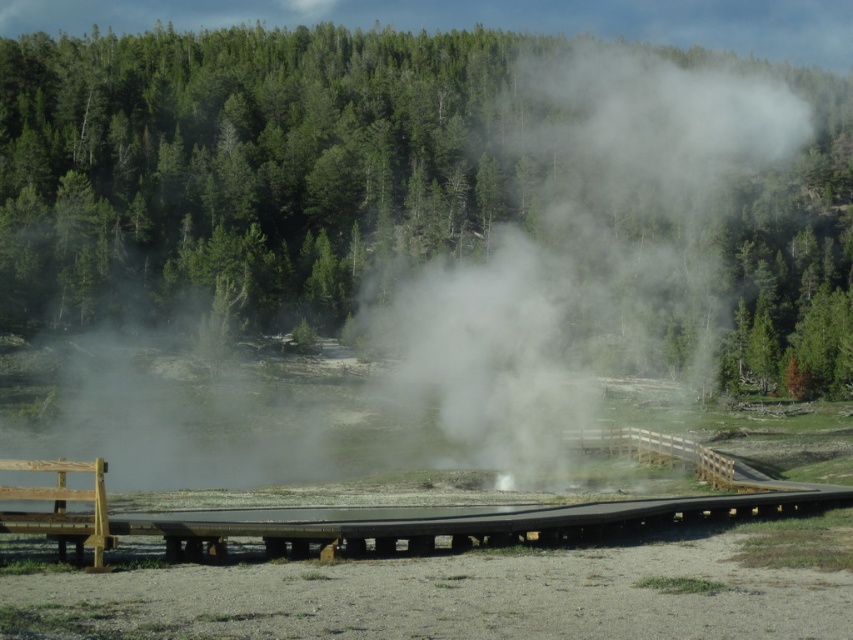
Where is `black wood rail at center`? black wood rail at center is located at coordinates (479, 516).

Which is below, black wood rail at center or wooden park bench at lower left?

black wood rail at center is below.

Is point (547, 516) behind point (114, 545)?

Yes, it is behind point (114, 545).

You are a GUI agent. You are given a task and a screenshot of the screen. Output one action in this format:
    pyautogui.click(x=<x>, y=<y>)
    Task: Click on the black wood rail at center
    
    Given the screenshot: What is the action you would take?
    pyautogui.click(x=479, y=516)

Measure the distance between white translucent steam at center and camera.

They are 61.94 meters apart.

Does white translucent steam at center have a smaller size compared to black wood rail at center?

No, white translucent steam at center is not smaller than black wood rail at center.

Between point (648, 83) and point (703, 508), which one is positioned behind?

Positioned behind is point (648, 83).

This screenshot has height=640, width=853. I want to click on white translucent steam at center, so (584, 257).

Is white translucent steam at center to the left of wooden park bench at lower left from the viewer's perspective?

No, white translucent steam at center is not to the left of wooden park bench at lower left.

Does white translucent steam at center appear on the right side of wooden park bench at lower left?

Correct, you'll find white translucent steam at center to the right of wooden park bench at lower left.

Is point (561, 433) less distant than point (103, 509)?

No, (561, 433) is further to viewer.

Where is `white translucent steam at center`? The height and width of the screenshot is (640, 853). white translucent steam at center is located at coordinates (584, 257).